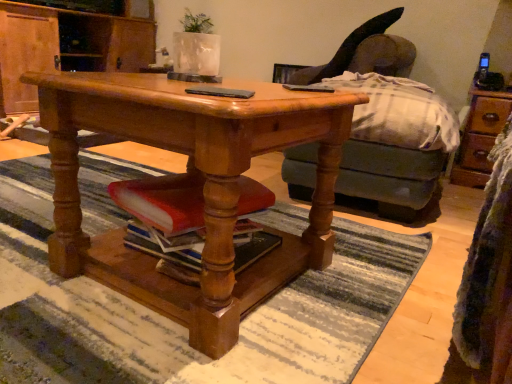
Where is `vacant space positioned to the left of black matte phone at center`? The height and width of the screenshot is (384, 512). vacant space positioned to the left of black matte phone at center is located at coordinates (158, 86).